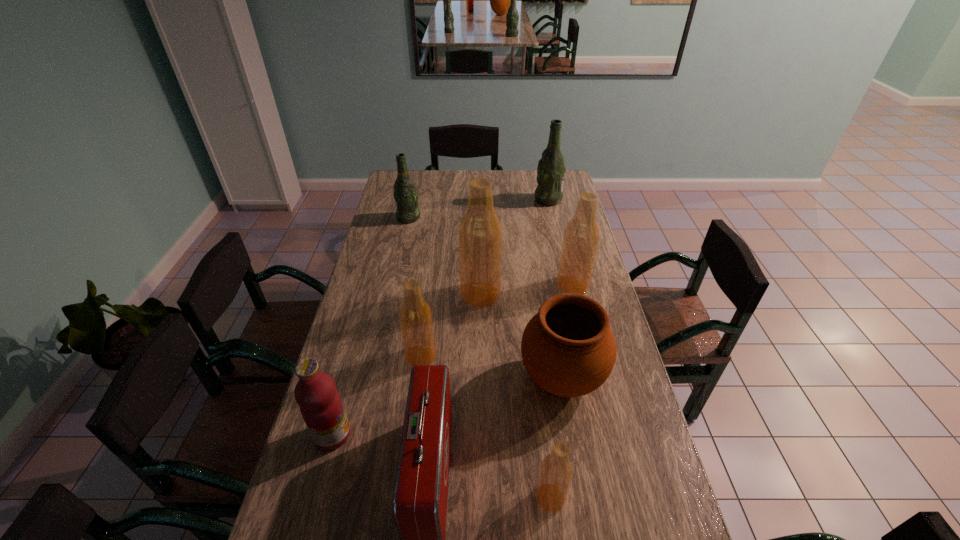
The width and height of the screenshot is (960, 540). Identify the location of free spot located on the label of the pink fruit juice. (433, 434).

Image resolution: width=960 pixels, height=540 pixels. Identify the location of vacant space located 0.120m on the back of the pottery. (552, 318).

The height and width of the screenshot is (540, 960). I want to click on vacant space located on the back of the smallest tan beer bottle, so click(x=539, y=392).

Where is `object located at the far edge`? object located at the far edge is located at coordinates (551, 169).

Identify the location of beer bottle at the left edge. The image size is (960, 540). (405, 194).

I want to click on fruit juice located in the left edge section of the desktop, so click(321, 407).

The height and width of the screenshot is (540, 960). Find the location of `pottery located in the right edge section of the desktop`. pottery located in the right edge section of the desktop is located at coordinates (568, 348).

Locate an element on the screen. object positioned at the far right corner is located at coordinates (551, 169).

I want to click on vacant position at the far edge of the desktop, so click(x=466, y=174).

Image resolution: width=960 pixels, height=540 pixels. Find the location of `free space at the left edge of the desktop`. free space at the left edge of the desktop is located at coordinates (390, 220).